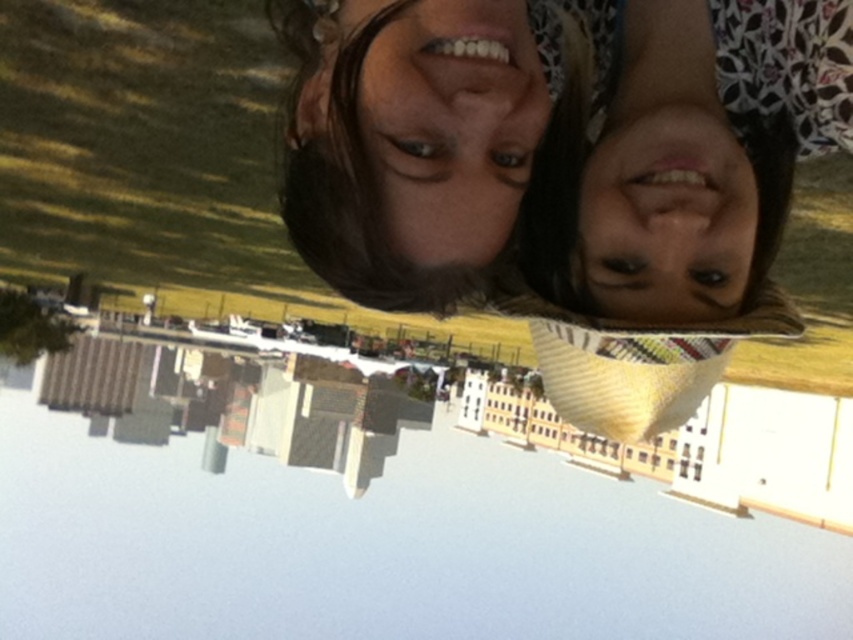
You are a photographer trying to capture a clear shot of the white glossy lake at center and the matte black hair at center in the rotated image. Since the image is rotated, you need to adjust your camera angle. Which object should you focus on first to ensure both are in frame?

You should focus on the white glossy lake at center first because the matte black hair at center is behind it. By centering the camera on the lake, you can adjust the angle to include both objects without losing the foreground element.

You are a photographer analyzing this rotated image. You notice the white glossy lake at center and the matte black hair at center. Which object is located lower in the image?

The white glossy lake at center is positioned under the matte black hair at center, so it is located lower in the image.